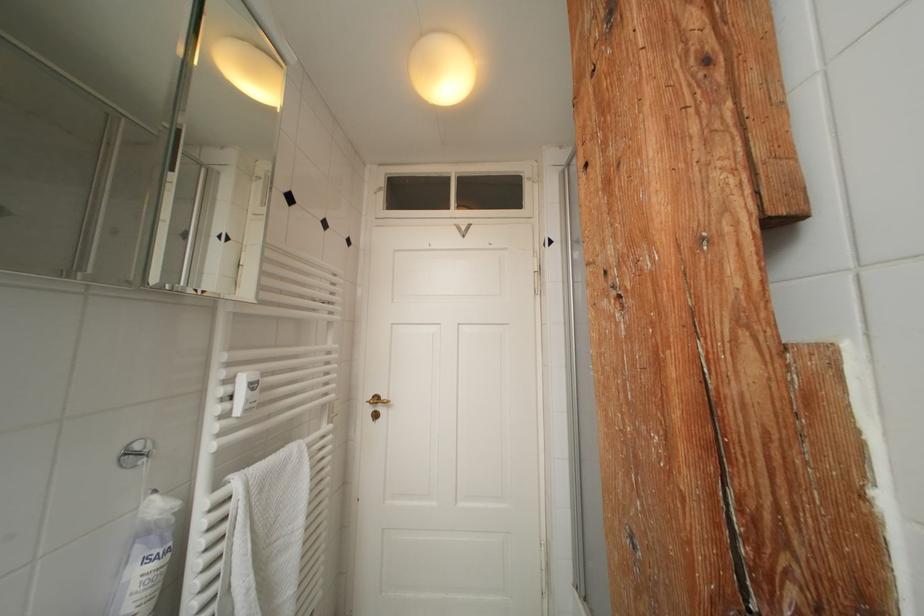
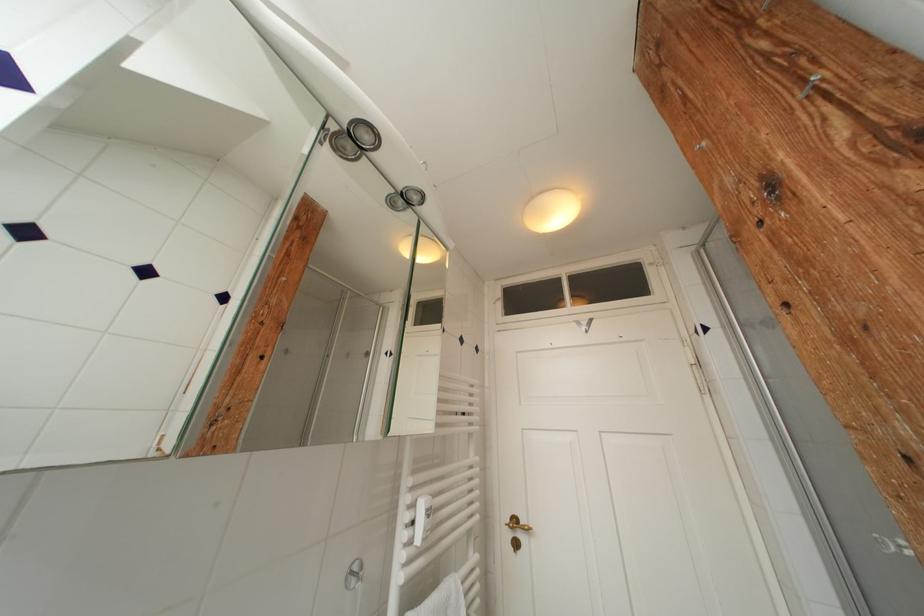
In the second image, find the point that corresponds to point (137, 456) in the first image.

(358, 578)